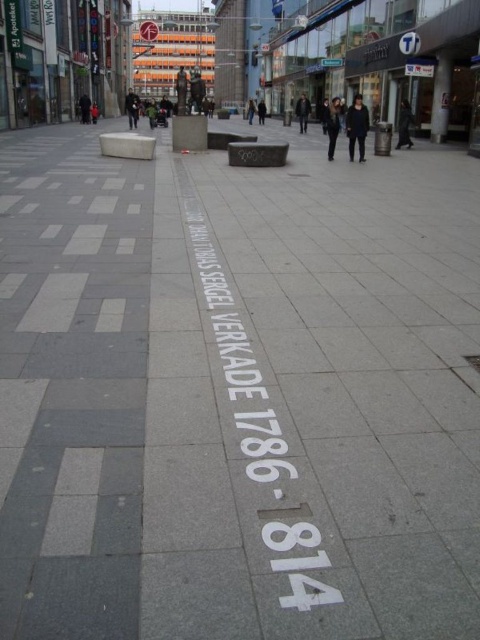
You are standing on the walkway and want to know which point is nearer to you. The points are point [300,522] and point [156,29]. Which one is closer to you?

Point [300,522] is closer to the camera than point [156,29].

You are a tourist in the city and want to take a photo of both the white painted text at center and the white plastic sign at upper center. Which object should you position yourself to the left of to ensure both are in the frame?

You should position yourself to the left of the white plastic sign at upper center because the white painted text at center is to the right of it, so placing yourself to the left of the sign will allow both objects to be captured in the photo.